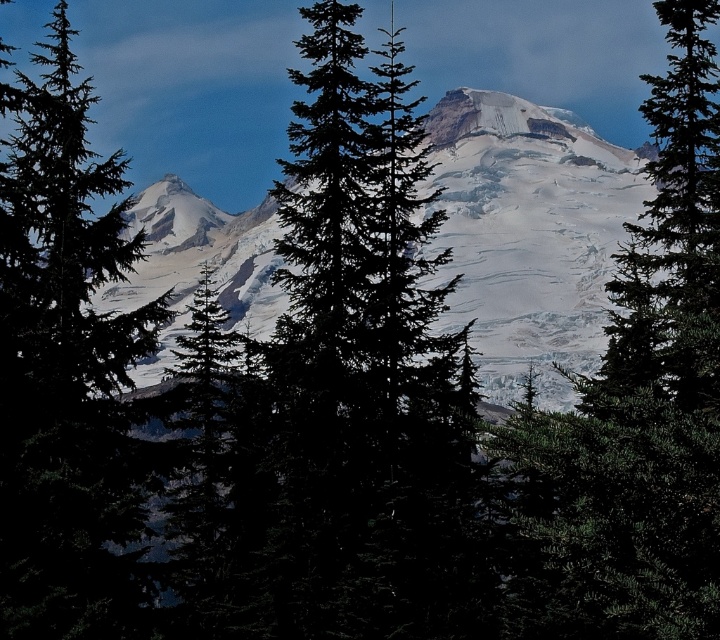
Question: Which point is closer to the camera taking this photo?

Choices:
 (A) (482, 195)
 (B) (482, 100)
 (C) (534, 518)

Answer: (C)

Question: Can you confirm if snowy granite mountain at center is wider than white snow-covered peak at center?

Choices:
 (A) no
 (B) yes

Answer: (B)

Question: Can you confirm if green matte tree at left is positioned above white snow-covered peak at center?

Choices:
 (A) yes
 (B) no

Answer: (B)

Question: Is green matte tree at left wider than snowy granite mountain at center?

Choices:
 (A) yes
 (B) no

Answer: (B)

Question: Which of the following is the farthest from the observer?

Choices:
 (A) snowy granite mountain at center
 (B) green matte tree at left
 (C) snowy granite peak at upper left

Answer: (C)

Question: Which object appears farthest from the camera in this image?

Choices:
 (A) green matte tree at center
 (B) green matte tree at left
 (C) white snow-covered peak at center

Answer: (C)